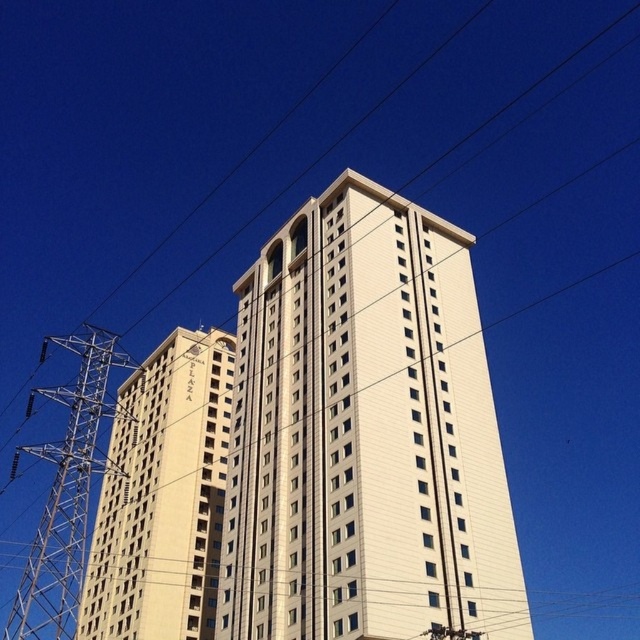
Question: Does beige stone building at left appear over metallic silver tower at left?

Choices:
 (A) no
 (B) yes

Answer: (B)

Question: Which point is closer to the camera?

Choices:
 (A) beige stone building at left
 (B) metallic silver tower at left

Answer: (A)

Question: Can you confirm if white smooth building at center is thinner than metallic silver tower at left?

Choices:
 (A) yes
 (B) no

Answer: (A)

Question: Which point is farther to the camera?

Choices:
 (A) white smooth building at center
 (B) beige stone building at left

Answer: (B)

Question: Observing the image, what is the correct spatial positioning of white smooth building at center in reference to beige stone building at left?

Choices:
 (A) left
 (B) right

Answer: (B)

Question: Which point is farther to the camera?

Choices:
 (A) white smooth building at center
 (B) beige stone building at left

Answer: (B)